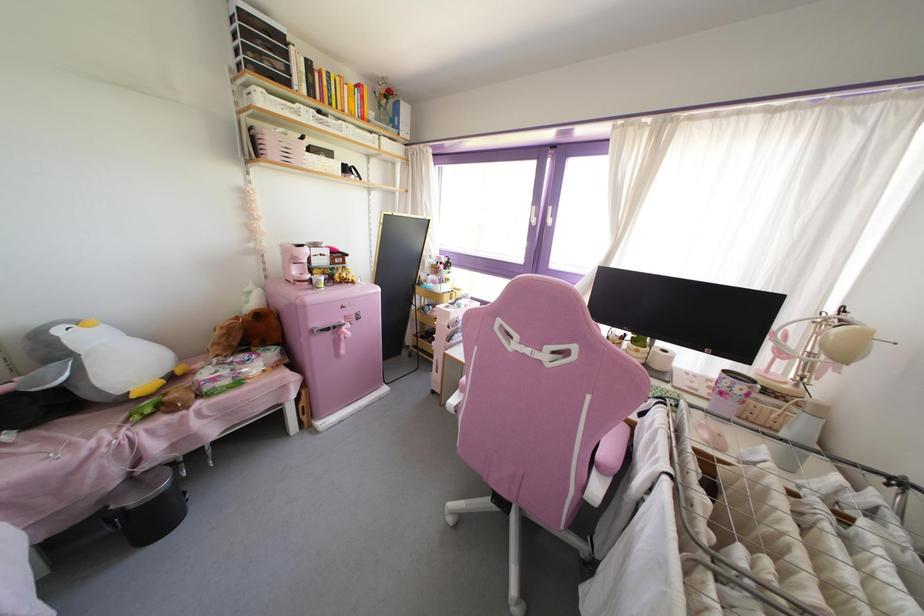
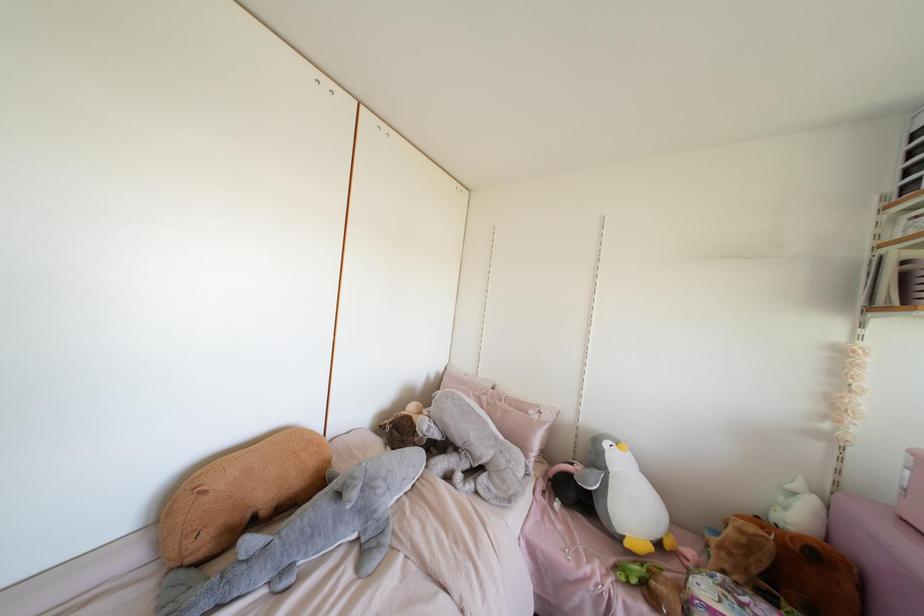
Find the pixel in the second image that matches [134,395] in the first image.

(626, 544)